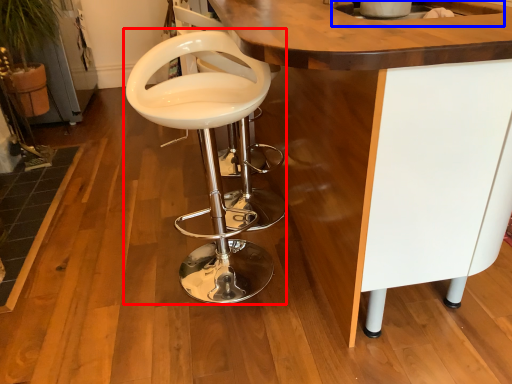
Question: Which object appears closest to the camera in this image, chair (highlighted by a red box) or sink (highlighted by a blue box)?

Choices:
 (A) chair
 (B) sink

Answer: (A)